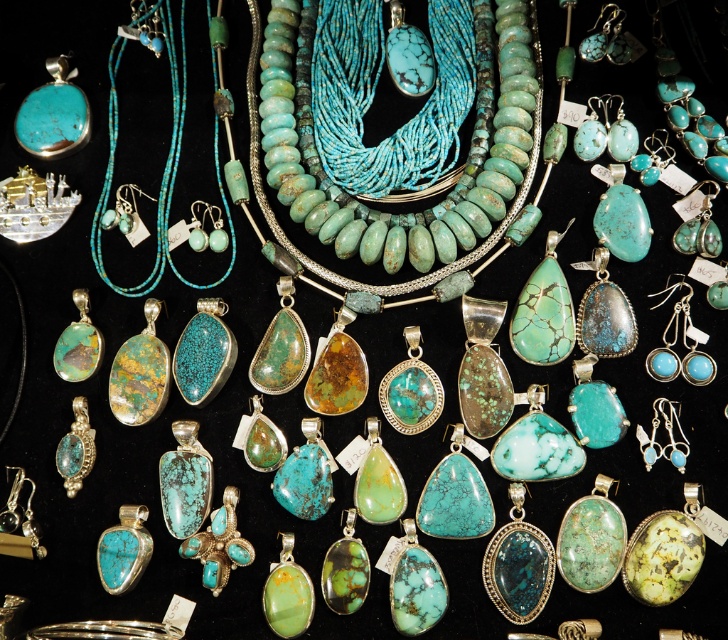
You are examining the turquoise jewelry arrangement. There are two points marked in the image. One is at coordinate point (x=475, y=17) and the other at point (x=98, y=243). Which point is closer to you?

Point (x=475, y=17) is further to the viewer than point (x=98, y=243), so the point at (x=475, y=17) is closer to you.

What is located at the coordinates point (403, 141) in the image?

Turquoise stone beads are located at point (403, 141).